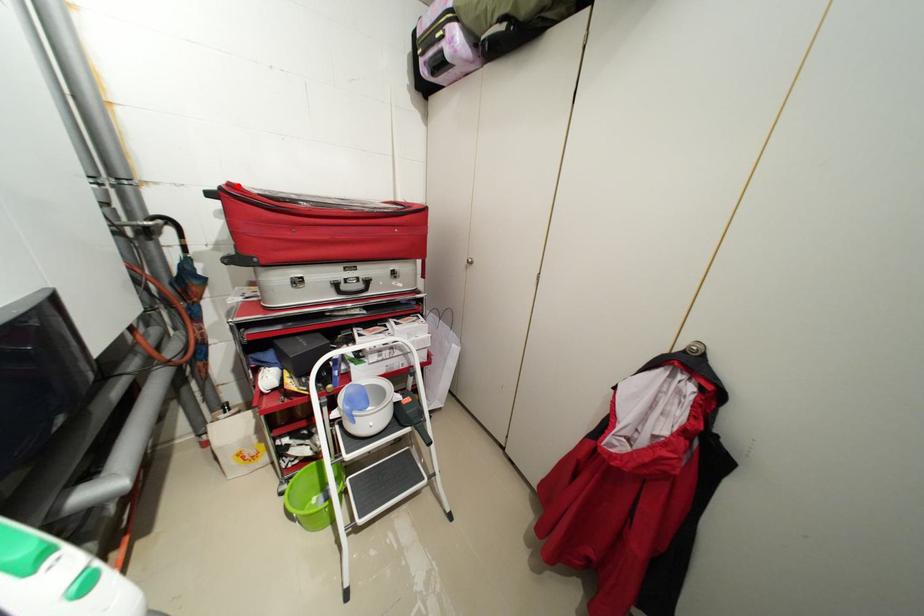
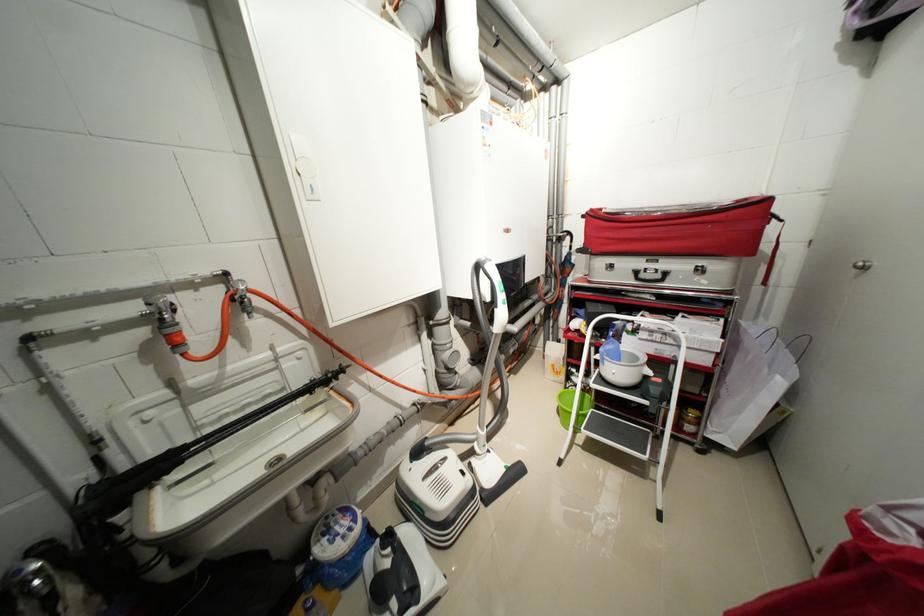
In the second image, find the point that corresponds to the highlighted location in the first image.

(599, 211)